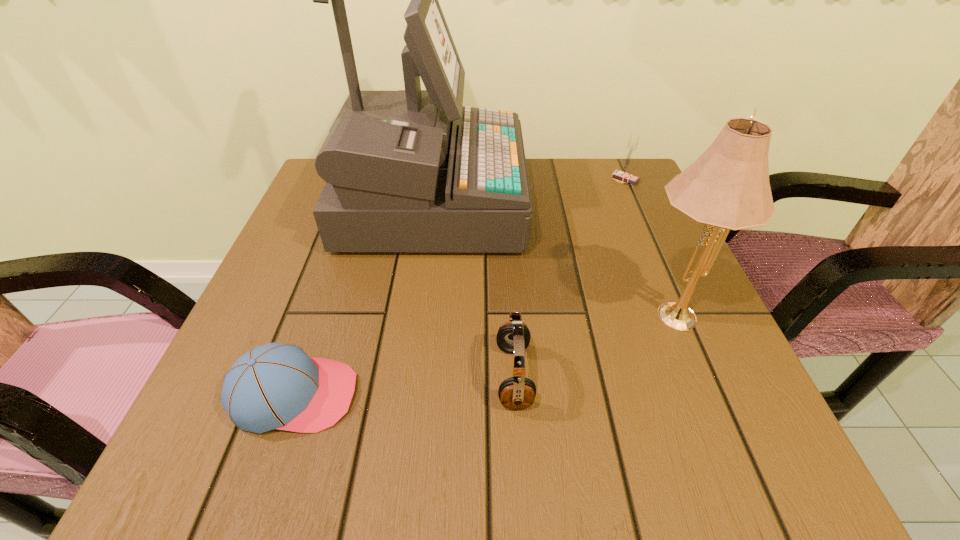
Where is `vacant position in the image that satisfies the following two spatial constraints: 1. on the front side of the matchbox; 2. on the customer-facing side of the cash register`? vacant position in the image that satisfies the following two spatial constraints: 1. on the front side of the matchbox; 2. on the customer-facing side of the cash register is located at coordinates (635, 201).

You are a GUI agent. You are given a task and a screenshot of the screen. Output one action in this format:
    pyautogui.click(x=<x>, y=<y>)
    Task: Click on the vacant region that satisfies the following two spatial constraints: 1. on the customer-facing side of the cash register; 2. on the right side of the second tallest object
    
    Given the screenshot: What is the action you would take?
    pyautogui.click(x=413, y=312)